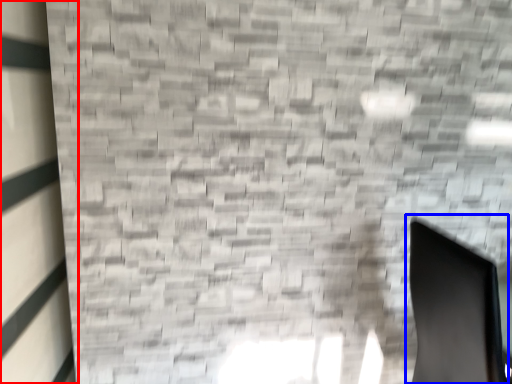
Question: Which object appears farthest to the camera in this image, window (highlighted by a red box) or swivel chair (highlighted by a blue box)?

Choices:
 (A) window
 (B) swivel chair

Answer: (B)